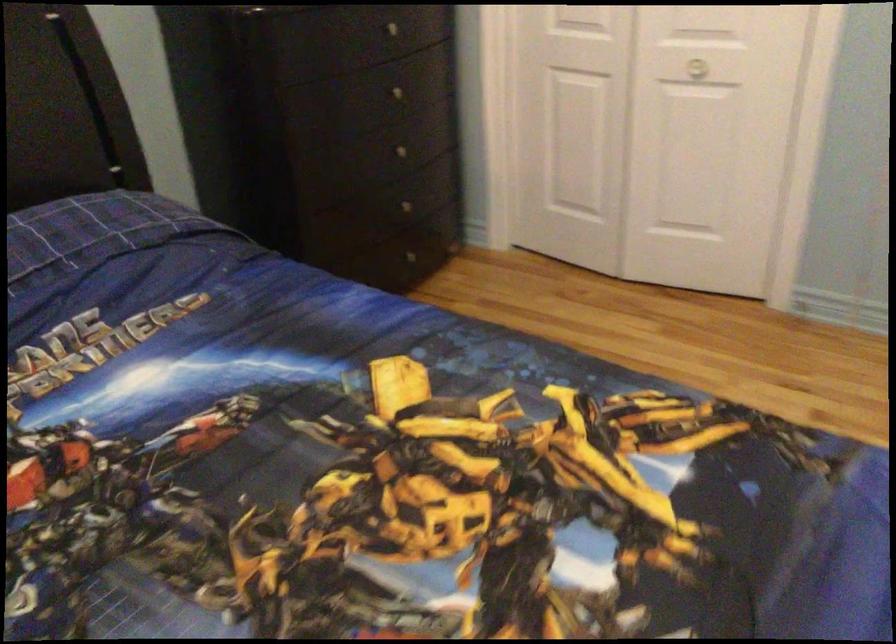
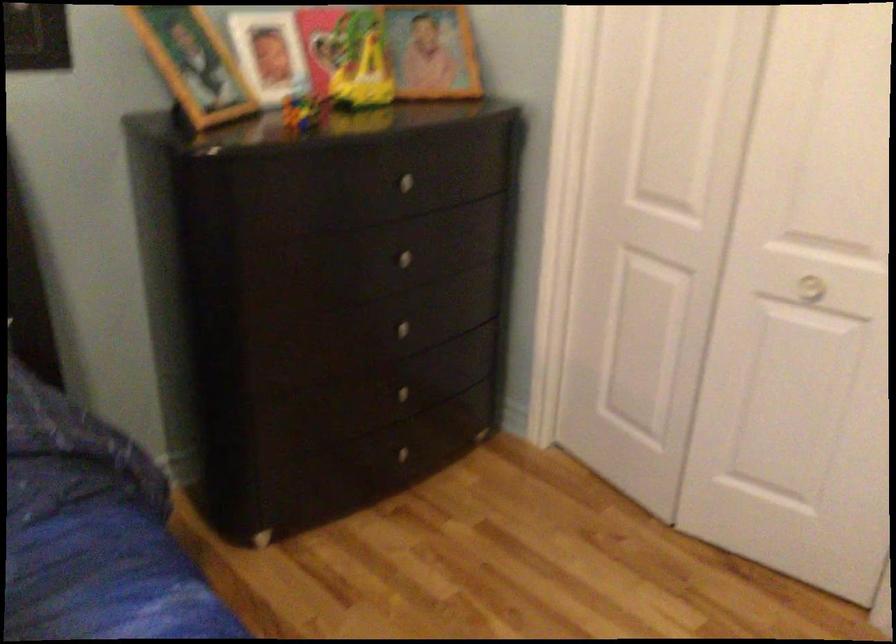
Locate, in the second image, the point that corresponds to point 392,93 in the first image.

(399, 258)